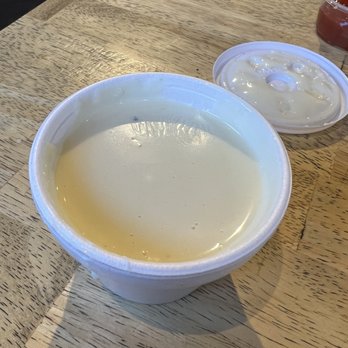
The image size is (348, 348). Identify the location of red jar. (332, 29).